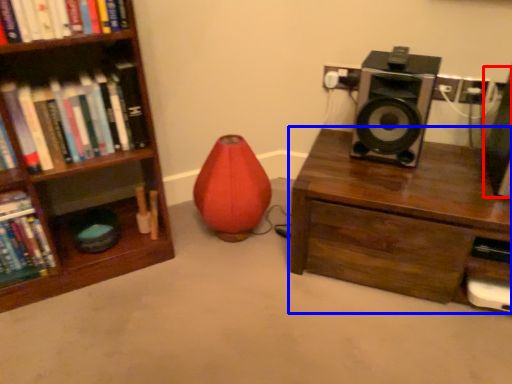
Question: Which of the following is the farthest to the observer, speaker (highlighted by a red box) or desk (highlighted by a blue box)?

Choices:
 (A) speaker
 (B) desk

Answer: (B)